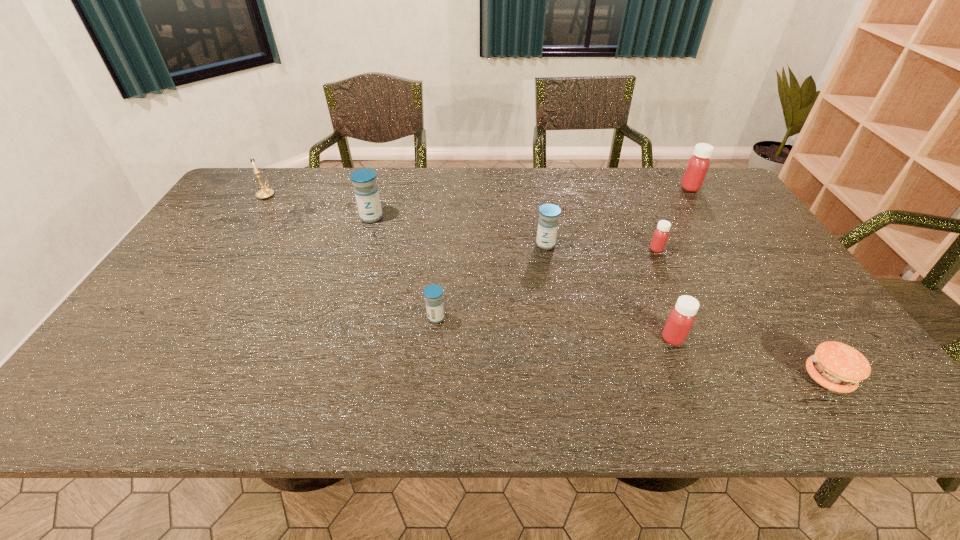
Identify the location of vacant space that satisfies the following two spatial constraints: 1. on the handle side of the candle holder; 2. on the left side of the rightmost red medicine. (272, 188).

Where is `vacant space that satisfies the following two spatial constraints: 1. on the front side of the patty; 2. on the right side of the farthest red medicine`? The image size is (960, 540). vacant space that satisfies the following two spatial constraints: 1. on the front side of the patty; 2. on the right side of the farthest red medicine is located at coordinates (813, 377).

Where is `free space that satisfies the following two spatial constraints: 1. on the front side of the nearest blue medicine; 2. on the left side of the shortest object`? The width and height of the screenshot is (960, 540). free space that satisfies the following two spatial constraints: 1. on the front side of the nearest blue medicine; 2. on the left side of the shortest object is located at coordinates (430, 377).